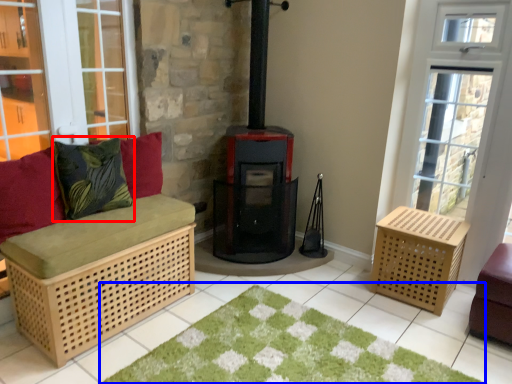
Question: Which point is closer to the camera, pillow (highlighted by a red box) or doormat (highlighted by a blue box)?

Choices:
 (A) pillow
 (B) doormat

Answer: (B)